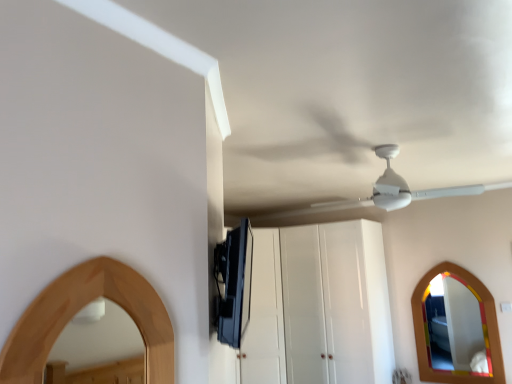
The width and height of the screenshot is (512, 384). What do you see at coordinates (234, 283) in the screenshot? I see `satin black tv at upper center` at bounding box center [234, 283].

What do you see at coordinates (336, 303) in the screenshot?
I see `white glossy cabinet at center` at bounding box center [336, 303].

What do you see at coordinates (353, 162) in the screenshot? I see `white matte fan at upper center` at bounding box center [353, 162].

The image size is (512, 384). Identify the location of satin black tv at upper center. (234, 283).

Is white glossy cabinet at center facing away from white matte fan at upper center?

No, white glossy cabinet at center is not facing the opposite direction of white matte fan at upper center.

Is white glossy cabinet at center wider than white matte fan at upper center?

Incorrect, the width of white glossy cabinet at center does not surpass that of white matte fan at upper center.

Can you tell me how much white glossy cabinet at center and white matte fan at upper center differ in facing direction?

8.34e-05 degrees.

Which point is more forward, [359,256] or [381,145]?

The point [381,145] is in front.

From a real-world perspective, which is physically below, white glossy cabinet at center or satin black tv at upper center?

From a 3D spatial view, white glossy cabinet at center is below.

Which object is closer to the camera, white glossy cabinet at center or satin black tv at upper center?

Positioned in front is satin black tv at upper center.

The image size is (512, 384). Find the location of `glass door on the right of satin black tv at upper center`. glass door on the right of satin black tv at upper center is located at coordinates (x=336, y=303).

Considering the sizes of objects white glossy cabinet at center and satin black tv at upper center in the image provided, who is smaller, white glossy cabinet at center or satin black tv at upper center?

Smaller between the two is satin black tv at upper center.

Is wooden mirror at lower right far from white matte fan at upper center?

Yes.

Considering the sizes of wooden mirror at lower right and white matte fan at upper center in the image, is wooden mirror at lower right bigger or smaller than white matte fan at upper center?

Clearly, wooden mirror at lower right is smaller in size than white matte fan at upper center.

From a real-world perspective, relative to white matte fan at upper center, is wooden mirror at lower right vertically above or below?

wooden mirror at lower right is situated lower than white matte fan at upper center in the real world.

Is satin black tv at upper center touching white matte fan at upper center?

No, satin black tv at upper center is not next to white matte fan at upper center.

From a real-world perspective, is satin black tv at upper center on top of white matte fan at upper center?

No, from a real-world perspective, satin black tv at upper center is not above white matte fan at upper center.

Which point is more forward, (231,294) or (392,192)?

The point (231,294) is in front.

Would you say wooden mirror at lower right is outside white glossy cabinet at center?

wooden mirror at lower right is positioned outside white glossy cabinet at center.

Which is in front, wooden mirror at lower right or white glossy cabinet at center?

wooden mirror at lower right is closer to the camera.

Identify the location of mirror in front of the white glossy cabinet at center. Image resolution: width=512 pixels, height=384 pixels. (456, 328).

From a real-world perspective, which is physically above, satin black tv at upper center or wooden mirror at lower right?

From a 3D spatial view, satin black tv at upper center is above.

Which object is further away from the camera taking this photo, satin black tv at upper center or wooden mirror at lower right?

wooden mirror at lower right.

Considering the sizes of objects satin black tv at upper center and wooden mirror at lower right in the image provided, who is smaller, satin black tv at upper center or wooden mirror at lower right?

wooden mirror at lower right.

Who is taller, satin black tv at upper center or wooden mirror at lower right?

Standing taller between the two is wooden mirror at lower right.

Consider the image. Could you tell me if satin black tv at upper center is turned towards white glossy cabinet at center?

No, satin black tv at upper center is not aimed at white glossy cabinet at center.

Is satin black tv at upper center completely or partially outside of white glossy cabinet at center?

Yes, satin black tv at upper center is located beyond the bounds of white glossy cabinet at center.

Considering the sizes of satin black tv at upper center and white glossy cabinet at center in the image, is satin black tv at upper center wider or thinner than white glossy cabinet at center?

Considering their sizes, satin black tv at upper center looks slimmer than white glossy cabinet at center.

In the scene shown: Is satin black tv at upper center further to the viewer compared to white glossy cabinet at center?

No, the depth of satin black tv at upper center is less than that of white glossy cabinet at center.

This screenshot has height=384, width=512. I want to click on glass door below the white matte fan at upper center (from the image's perspective), so click(x=336, y=303).

At what (x,y) coordinates should I click in order to perform the action: click on appliance above the white glossy cabinet at center (from a real-world perspective). Please return your answer as a coordinate pair (x, y). The height and width of the screenshot is (384, 512). Looking at the image, I should click on (234, 283).

Looking at this image, considering their positions, is satin black tv at upper center positioned closer to white matte fan at upper center than wooden mirror at lower right?

satin black tv at upper center.

From the image, which object appears to be farther from wooden mirror at lower right, white matte fan at upper center or white glossy cabinet at center?

The object further to wooden mirror at lower right is white matte fan at upper center.

Estimate the real-world distances between objects in this image. Which object is closer to white matte fan at upper center, wooden mirror at lower right or white glossy cabinet at center?

The object closer to white matte fan at upper center is white glossy cabinet at center.

When comparing their distances from white glossy cabinet at center, does white matte fan at upper center or wooden mirror at lower right seem closer?

wooden mirror at lower right is positioned closer to the anchor white glossy cabinet at center.

Considering their positions, is white matte fan at upper center positioned closer to satin black tv at upper center than white glossy cabinet at center?

Among the two, white matte fan at upper center is located nearer to satin black tv at upper center.

Based on their spatial positions, is satin black tv at upper center or wooden mirror at lower right further from white glossy cabinet at center?

satin black tv at upper center.

When comparing their distances from white matte fan at upper center, does white glossy cabinet at center or wooden mirror at lower right seem further?

wooden mirror at lower right lies further to white matte fan at upper center than the other object.

Which object lies further to the anchor point white glossy cabinet at center, wooden mirror at lower right or white matte fan at upper center?

white matte fan at upper center is positioned further to the anchor white glossy cabinet at center.

Where is `mirror positioned between satin black tv at upper center and white glossy cabinet at center from near to far`? mirror positioned between satin black tv at upper center and white glossy cabinet at center from near to far is located at coordinates (456, 328).

You are a GUI agent. You are given a task and a screenshot of the screen. Output one action in this format:
    pyautogui.click(x=<x>, y=<y>)
    Task: Click on the fan between satin black tv at upper center and white glossy cabinet at center in the front-back direction
    The width and height of the screenshot is (512, 384).
    Given the screenshot: What is the action you would take?
    pyautogui.click(x=353, y=162)

You are a GUI agent. You are given a task and a screenshot of the screen. Output one action in this format:
    pyautogui.click(x=<x>, y=<y>)
    Task: Click on the mirror located between white matte fan at upper center and white glossy cabinet at center in the depth direction
    Image resolution: width=512 pixels, height=384 pixels.
    Given the screenshot: What is the action you would take?
    pyautogui.click(x=456, y=328)

Where is `fan between satin black tv at upper center and wooden mirror at lower right in the front-back direction`? fan between satin black tv at upper center and wooden mirror at lower right in the front-back direction is located at coordinates (353, 162).